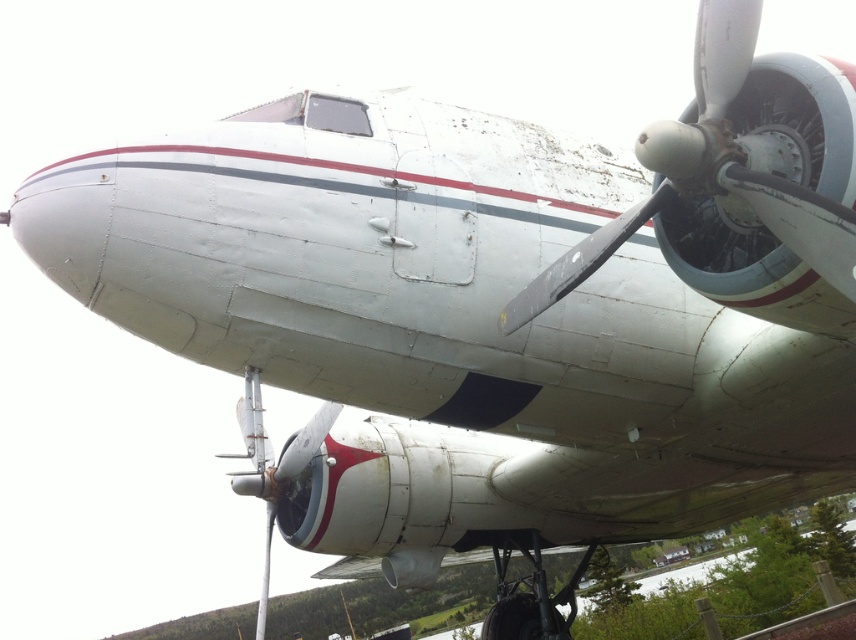
Who is more distant from viewer, (702, 144) or (288, 445)?

Positioned behind is point (288, 445).

Locate an element on the screen. This screenshot has height=640, width=856. white matte propeller at center is located at coordinates (742, 186).

The image size is (856, 640). I want to click on white matte propeller at center, so (742, 186).